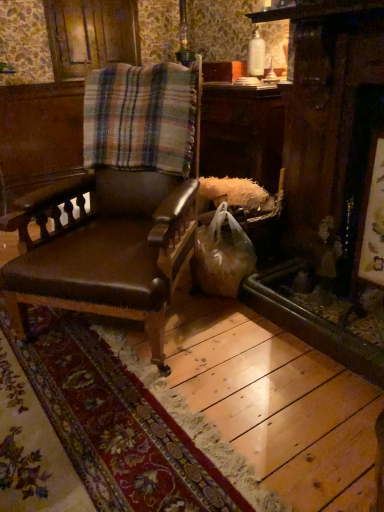
Question: Looking at their shapes, would you say translucent plastic bag at lower right is wider or thinner than matte brown leather chair at center?

Choices:
 (A) wide
 (B) thin

Answer: (B)

Question: Based on their sizes in the image, would you say translucent plastic bag at lower right is bigger or smaller than matte brown leather chair at center?

Choices:
 (A) big
 (B) small

Answer: (B)

Question: Estimate the real-world distances between objects in this image. Which object is farther from the plaid fabric at center?

Choices:
 (A) matte brown leather chair at center
 (B) translucent plastic bag at lower right

Answer: (B)

Question: Considering the real-world distances, which object is farthest from the matte brown leather chair at center?

Choices:
 (A) translucent plastic bag at lower right
 (B) plaid fabric at center

Answer: (A)